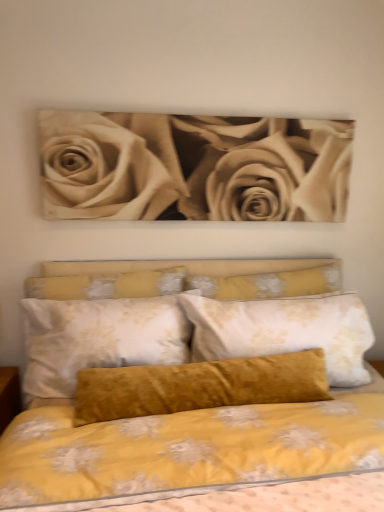
Find the location of a particular element. The image size is (384, 512). free spot above sepia-toned roses at upper center (from a real-world perspective) is located at coordinates (208, 111).